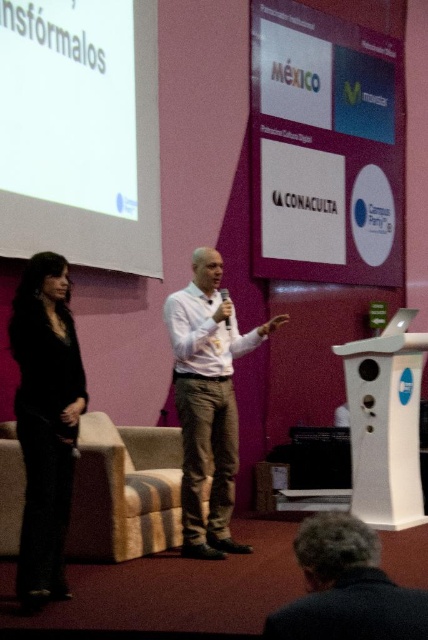
You are an event organizer who needs to place a banner between the white matte projection screen at upper left and the white shirt at center. Which object requires a wider banner to cover its width?

The white matte projection screen at upper left requires a wider banner because its width is larger than the white shirt at center.

You are an event organizer checking the stage setup. You notice the white matte projection screen at upper left and the white shirt at center. Which object is located above the other?

The white matte projection screen at upper left is positioned over the white shirt at center, meaning it is above the white shirt at center.

You are a technician setting up equipment for a presentation. The camera you need to position is 12.92 feet away from the white matte projection screen at upper left. Is this distance sufficient to ensure the camera can capture the entire screen clearly?

The camera and the white matte projection screen at upper left are 12.92 feet apart. This distance should be sufficient for the camera to capture the entire screen clearly, provided the camera has an appropriate lens and is properly angled.